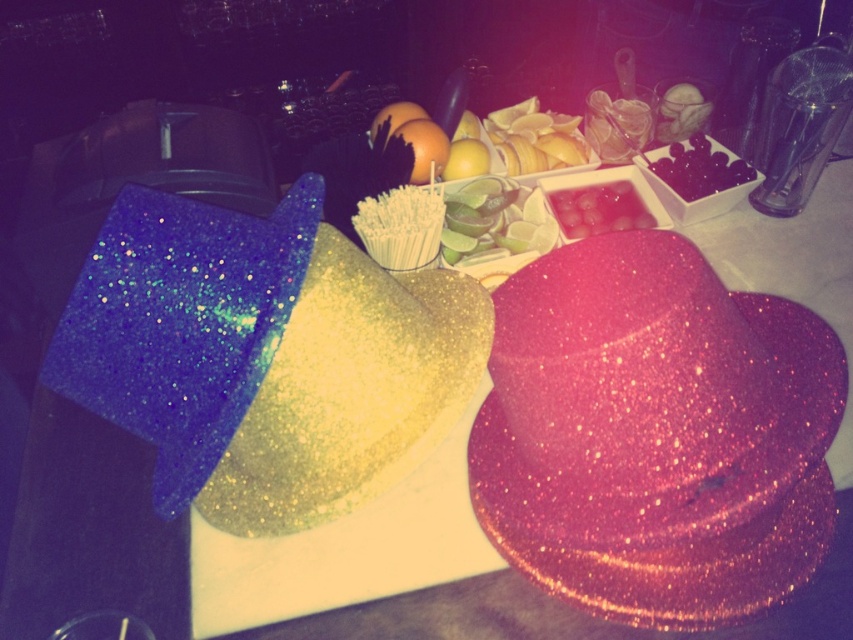
You are arranging a party snack table and have a small container that can only hold items narrower than 10 cm. You see the green matte lime at center and the black glossy grapes at upper right. Which of these items can definitely fit into the container without exceeding the width limit?

The black glossy grapes at upper right can definitely fit into the container since the green matte lime at center might be wider than them, potentially exceeding the 10 cm limit.

You are at a party and want to know which item is bigger between the pink glittery hat at center and the pink glittery watermelon at center. Which one is larger?

The pink glittery hat at center is larger than the pink glittery watermelon at center.